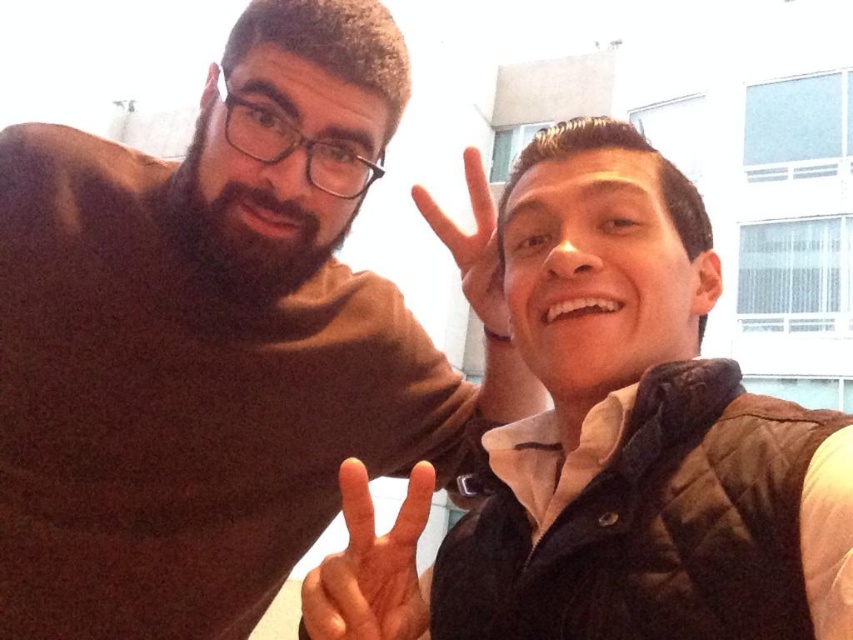
Is brown quilted vest at right shorter than matte black hand at center?

No.

What do you see at coordinates (631, 428) in the screenshot?
I see `brown quilted vest at right` at bounding box center [631, 428].

The image size is (853, 640). Find the location of `brown quilted vest at right`. brown quilted vest at right is located at coordinates (631, 428).

Is point (323, 620) in front of point (463, 170)?

Yes, point (323, 620) is closer to viewer.

Can you confirm if light skin tone flesh at center is thinner than matte black hand at center?

Correct, light skin tone flesh at center's width is less than matte black hand at center's.

Is point (363, 531) farther from camera compared to point (445, 216)?

No, it is not.

Find the location of a particular element. light skin tone flesh at center is located at coordinates (370, 566).

Between brown matte shirt at left and matte black hand at center, which one has less height?

matte black hand at center is shorter.

Image resolution: width=853 pixels, height=640 pixels. I want to click on brown matte shirt at left, so (219, 339).